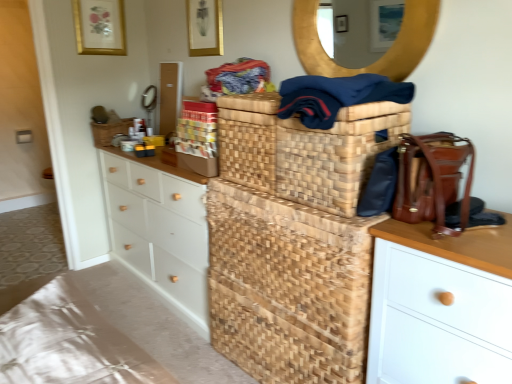
At what (x,y) coordinates should I click in order to perform the action: click on blank space situated above woven brown basket at center, which appears as the first basket when viewed from the left (from a real-world perspective). Please return your answer as a coordinate pair (x, y). The width and height of the screenshot is (512, 384). Looking at the image, I should click on (113, 125).